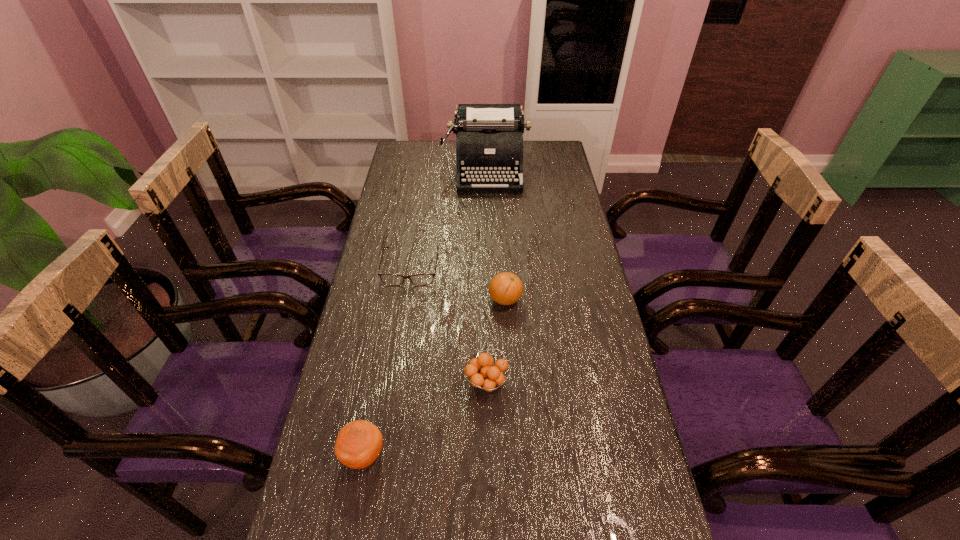
Locate an element on the screen. This screenshot has width=960, height=540. typewriter is located at coordinates (489, 145).

In order to click on the tallest object in this screenshot , I will do `click(489, 145)`.

At what (x,y) coordinates should I click in order to perform the action: click on the leftmost orange fruit. Please return your answer as a coordinate pair (x, y). Looking at the image, I should click on (359, 443).

You are a GUI agent. You are given a task and a screenshot of the screen. Output one action in this format:
    pyautogui.click(x=<x>, y=<y>)
    Task: Click on the nearest orange fruit
    The width and height of the screenshot is (960, 540).
    Given the screenshot: What is the action you would take?
    [359, 443]

I want to click on the third farthest object, so click(x=505, y=288).

Identify the location of the second nearest orange fruit. pyautogui.click(x=482, y=373).

Where is `the shortest object`? The width and height of the screenshot is (960, 540). the shortest object is located at coordinates (389, 279).

Find the location of a particular element. This screenshot has height=540, width=960. spectacles is located at coordinates (389, 279).

Where is `vacant space situated on the typing side of the tallest object`? The image size is (960, 540). vacant space situated on the typing side of the tallest object is located at coordinates (488, 256).

Locate an element on the screen. The height and width of the screenshot is (540, 960). vacant area situated on the right of the nearest orange fruit is located at coordinates (559, 455).